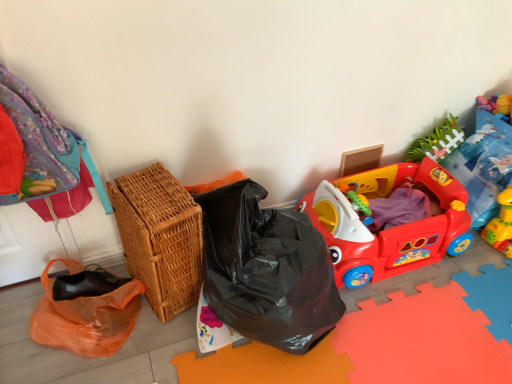
How much space does rubberized plastic play car at right, which is the second toy from right to left, occupy horizontally?

It is 48.95 centimeters.

You are a GUI agent. You are given a task and a screenshot of the screen. Output one action in this format:
    pyautogui.click(x=<x>, y=<y>)
    Task: Click on the matte cardboard box at upper right
    
    Given the screenshot: What is the action you would take?
    pyautogui.click(x=360, y=160)

Does matte cardboard box at upper right have a smaller size compared to woven brown basket at left?

Yes.

Can you tell me how much matte cardboard box at upper right and woven brown basket at left differ in facing direction?

14.8 degrees.

From a real-world perspective, between matte cardboard box at upper right and woven brown basket at left, who is vertically higher?

woven brown basket at left.

From the image's perspective, between yellow rubber duck at lower right, the 2th toy from the left, and matte cardboard box at upper right, which one is located above?

matte cardboard box at upper right is shown above in the image.

Is yellow rubber duck at lower right, the 2th toy from the left, facing towards matte cardboard box at upper right?

No, yellow rubber duck at lower right, the 2th toy from the left, is not facing towards matte cardboard box at upper right.

From a real-world perspective, is yellow rubber duck at lower right, the 2th toy from the left, above or below matte cardboard box at upper right?

yellow rubber duck at lower right, the 2th toy from the left, is below matte cardboard box at upper right.

How far apart are yellow rubber duck at lower right, the 2th toy from the left, and matte cardboard box at upper right?

They are 60.24 centimeters apart.

Is woven brown basket at left oriented away from rubberized plastic play car at right, which is the second toy from right to left?

No.

Is rubberized plastic play car at right, the first toy when ordered from left to right, located within woven brown basket at left?

No.

You are a GUI agent. You are given a task and a screenshot of the screen. Output one action in this format:
    pyautogui.click(x=<x>, y=<y>)
    Task: Click on the toy that is the 1st object located behind the woven brown basket at left
    The image size is (512, 384).
    Given the screenshot: What is the action you would take?
    (390, 228)

Is rubberized plastic play car at right, the first toy when ordered from left to right, far from matte cardboard box at upper right?

Actually, rubberized plastic play car at right, the first toy when ordered from left to right, and matte cardboard box at upper right are a little close together.

Can you confirm if rubberized plastic play car at right, which is the second toy from right to left, is taller than matte cardboard box at upper right?

Correct, rubberized plastic play car at right, which is the second toy from right to left, is much taller as matte cardboard box at upper right.

Between rubberized plastic play car at right, the first toy when ordered from left to right, and matte cardboard box at upper right, which one has smaller size?

With smaller size is matte cardboard box at upper right.

In the scene shown: Is rubberized plastic play car at right, the first toy when ordered from left to right, spatially inside matte cardboard box at upper right, or outside of it?

rubberized plastic play car at right, the first toy when ordered from left to right, is outside matte cardboard box at upper right.

Considering the sizes of yellow rubber duck at lower right, arranged as the first toy when viewed from the right, and rubberized plastic play car at right, the first toy when ordered from left to right, in the image, is yellow rubber duck at lower right, arranged as the first toy when viewed from the right, wider or thinner than rubberized plastic play car at right, the first toy when ordered from left to right,?

Clearly, yellow rubber duck at lower right, arranged as the first toy when viewed from the right, has less width compared to rubberized plastic play car at right, the first toy when ordered from left to right.

From the picture: In the image, is yellow rubber duck at lower right, arranged as the first toy when viewed from the right, on the left side or the right side of rubberized plastic play car at right, the first toy when ordered from left to right?

In the image, yellow rubber duck at lower right, arranged as the first toy when viewed from the right, appears on the right side of rubberized plastic play car at right, the first toy when ordered from left to right.

Is yellow rubber duck at lower right, arranged as the first toy when viewed from the right, shorter than rubberized plastic play car at right, which is the second toy from right to left?

Correct, yellow rubber duck at lower right, arranged as the first toy when viewed from the right, is not as tall as rubberized plastic play car at right, which is the second toy from right to left.

Is yellow rubber duck at lower right, arranged as the first toy when viewed from the right, positioned beyond the bounds of rubberized plastic play car at right, which is the second toy from right to left?

That's correct, yellow rubber duck at lower right, arranged as the first toy when viewed from the right, is outside of rubberized plastic play car at right, which is the second toy from right to left.

Can you confirm if yellow rubber duck at lower right, arranged as the first toy when viewed from the right, is positioned to the right of woven brown basket at left?

Yes, yellow rubber duck at lower right, arranged as the first toy when viewed from the right, is to the right of woven brown basket at left.

Which is behind, point (506, 224) or point (187, 227)?

Positioned behind is point (506, 224).

Who is more distant, yellow rubber duck at lower right, the 2th toy from the left, or woven brown basket at left?

yellow rubber duck at lower right, the 2th toy from the left, is more distant.

Is yellow rubber duck at lower right, arranged as the first toy when viewed from the right, placed right next to woven brown basket at left?

No, yellow rubber duck at lower right, arranged as the first toy when viewed from the right, is not touching woven brown basket at left.

Considering the relative sizes of matte cardboard box at upper right and yellow rubber duck at lower right, the 2th toy from the left, in the image provided, is matte cardboard box at upper right bigger than yellow rubber duck at lower right, the 2th toy from the left,?

No, matte cardboard box at upper right is not bigger than yellow rubber duck at lower right, the 2th toy from the left.

Is yellow rubber duck at lower right, the 2th toy from the left, at the back of matte cardboard box at upper right?

No, matte cardboard box at upper right is not facing away from yellow rubber duck at lower right, the 2th toy from the left.

Is matte cardboard box at upper right positioned beyond the bounds of yellow rubber duck at lower right, arranged as the first toy when viewed from the right?

Indeed, matte cardboard box at upper right is completely outside yellow rubber duck at lower right, arranged as the first toy when viewed from the right.

Is matte cardboard box at upper right taller than yellow rubber duck at lower right, the 2th toy from the left?

Incorrect, the height of matte cardboard box at upper right is not larger of that of yellow rubber duck at lower right, the 2th toy from the left.

The height and width of the screenshot is (384, 512). I want to click on cardboard box on the right of woven brown basket at left, so click(360, 160).

Where is `cardboard box above the yellow rubber duck at lower right, arranged as the first toy when viewed from the right (from a real-world perspective)`? This screenshot has height=384, width=512. cardboard box above the yellow rubber duck at lower right, arranged as the first toy when viewed from the right (from a real-world perspective) is located at coordinates (360, 160).

Which object lies further to the anchor point yellow rubber duck at lower right, arranged as the first toy when viewed from the right, rubberized plastic play car at right, which is the second toy from right to left, or woven brown basket at left?

woven brown basket at left lies further to yellow rubber duck at lower right, arranged as the first toy when viewed from the right, than the other object.

Looking at the image, which one is located further to yellow rubber duck at lower right, arranged as the first toy when viewed from the right, matte cardboard box at upper right or rubberized plastic play car at right, the first toy when ordered from left to right?

The object further to yellow rubber duck at lower right, arranged as the first toy when viewed from the right, is matte cardboard box at upper right.

From the picture: Which object lies further to the anchor point rubberized plastic play car at right, which is the second toy from right to left, woven brown basket at left or yellow rubber duck at lower right, the 2th toy from the left?

woven brown basket at left lies further to rubberized plastic play car at right, which is the second toy from right to left, than the other object.

Based on their spatial positions, is matte cardboard box at upper right or woven brown basket at left further from rubberized plastic play car at right, which is the second toy from right to left?

Among the two, woven brown basket at left is located further to rubberized plastic play car at right, which is the second toy from right to left.

When comparing their distances from rubberized plastic play car at right, the first toy when ordered from left to right, does yellow rubber duck at lower right, arranged as the first toy when viewed from the right, or woven brown basket at left seem closer?

Based on the image, yellow rubber duck at lower right, arranged as the first toy when viewed from the right, appears to be nearer to rubberized plastic play car at right, the first toy when ordered from left to right.

Estimate the real-world distances between objects in this image. Which object is further from woven brown basket at left, rubberized plastic play car at right, the first toy when ordered from left to right, or yellow rubber duck at lower right, arranged as the first toy when viewed from the right?

yellow rubber duck at lower right, arranged as the first toy when viewed from the right, lies further to woven brown basket at left than the other object.

Considering their positions, is matte cardboard box at upper right positioned closer to woven brown basket at left than yellow rubber duck at lower right, the 2th toy from the left?

Based on the image, matte cardboard box at upper right appears to be nearer to woven brown basket at left.

Based on their spatial positions, is rubberized plastic play car at right, the first toy when ordered from left to right, or matte cardboard box at upper right closer to yellow rubber duck at lower right, the 2th toy from the left?

Among the two, rubberized plastic play car at right, the first toy when ordered from left to right, is located nearer to yellow rubber duck at lower right, the 2th toy from the left.

Where is `toy situated between matte cardboard box at upper right and yellow rubber duck at lower right, arranged as the first toy when viewed from the right, from left to right`? toy situated between matte cardboard box at upper right and yellow rubber duck at lower right, arranged as the first toy when viewed from the right, from left to right is located at coordinates (390, 228).

The height and width of the screenshot is (384, 512). What are the coordinates of `cardboard box located between woven brown basket at left and yellow rubber duck at lower right, arranged as the first toy when viewed from the right, in the left-right direction` in the screenshot? It's located at (360, 160).

I want to click on toy located between woven brown basket at left and yellow rubber duck at lower right, the 2th toy from the left, in the left-right direction, so click(390, 228).

Identify the location of cardboard box located between woven brown basket at left and rubberized plastic play car at right, which is the second toy from right to left, in the left-right direction. (360, 160).